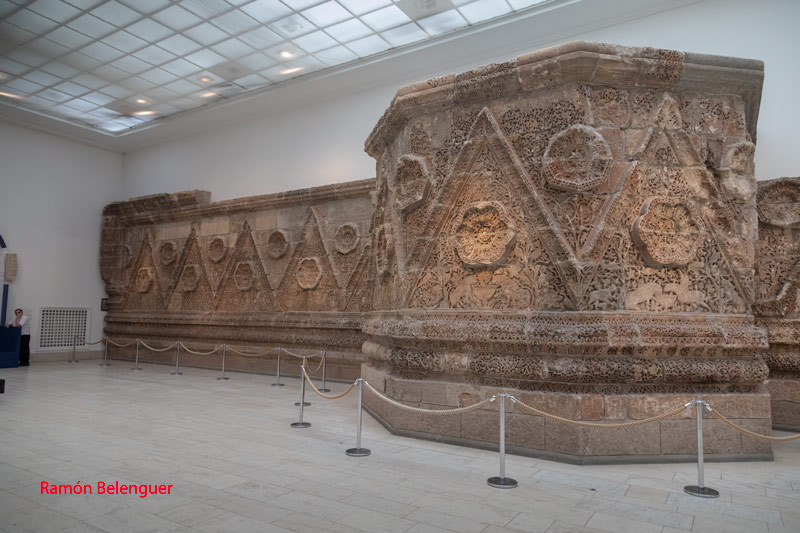
You are a GUI agent. You are given a task and a screenshot of the screen. Output one action in this format:
    pyautogui.click(x=<x>, y=<y>)
    Task: Click on the white tile
    This screenshot has height=533, width=800.
    Given the screenshot: What is the action you would take?
    pyautogui.click(x=344, y=505), pyautogui.click(x=169, y=444)